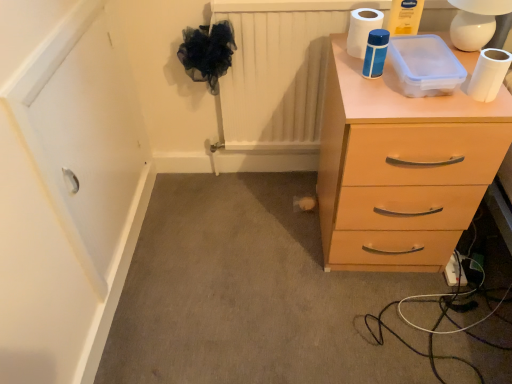
Question: Should I look upward or downward to see white matte toilet paper at upper right, which is the 2th toilet paper in right-to-left order?

Choices:
 (A) up
 (B) down

Answer: (A)

Question: From a real-world perspective, is white matte toilet paper at upper right, the 2th toilet paper in the top-to-bottom sequence, over white plastic extension cord at lower right?

Choices:
 (A) no
 (B) yes

Answer: (B)

Question: Does white matte toilet paper at upper right, which appears as the 1th toilet paper when ordered from the bottom, appear on the right side of white plastic extension cord at lower right?

Choices:
 (A) no
 (B) yes

Answer: (A)

Question: Is white plastic extension cord at lower right inside white matte toilet paper at upper right, which is the second toilet paper from back to front?

Choices:
 (A) yes
 (B) no

Answer: (B)

Question: Is white matte toilet paper at upper right, positioned as the 2th toilet paper in left-to-right order, touching white plastic extension cord at lower right?

Choices:
 (A) yes
 (B) no

Answer: (B)

Question: Is white matte toilet paper at upper right, the 2th toilet paper in the top-to-bottom sequence, in front of white plastic extension cord at lower right?

Choices:
 (A) yes
 (B) no

Answer: (A)

Question: Is white matte toilet paper at upper right, the 2th toilet paper in the top-to-bottom sequence, positioned far away from white plastic extension cord at lower right?

Choices:
 (A) yes
 (B) no

Answer: (B)

Question: Is white matte toilet paper at upper right, the 1th toilet paper when ordered from left to right, located outside white plastic extension cord at lower right?

Choices:
 (A) no
 (B) yes

Answer: (B)

Question: Is white matte toilet paper at upper right, the 1th toilet paper when ordered from left to right, taller than white plastic extension cord at lower right?

Choices:
 (A) yes
 (B) no

Answer: (A)

Question: Considering the relative positions of white matte toilet paper at upper right, arranged as the second toilet paper when viewed from the front, and white plastic extension cord at lower right in the image provided, is white matte toilet paper at upper right, arranged as the second toilet paper when viewed from the front, to the right of white plastic extension cord at lower right from the viewer's perspective?

Choices:
 (A) no
 (B) yes

Answer: (A)

Question: Is white matte toilet paper at upper right, which is the 2th toilet paper in right-to-left order, facing away from white plastic extension cord at lower right?

Choices:
 (A) yes
 (B) no

Answer: (B)

Question: Could white plastic extension cord at lower right be considered to be inside white matte toilet paper at upper right, the 1th toilet paper in the top-to-bottom sequence?

Choices:
 (A) no
 (B) yes

Answer: (A)

Question: Does white matte toilet paper at upper right, the 1th toilet paper when ordered from left to right, touch white plastic extension cord at lower right?

Choices:
 (A) yes
 (B) no

Answer: (B)

Question: Are white matte toilet paper at upper right, which is the 2th toilet paper in right-to-left order, and light wood chest of drawers at right far apart?

Choices:
 (A) yes
 (B) no

Answer: (B)